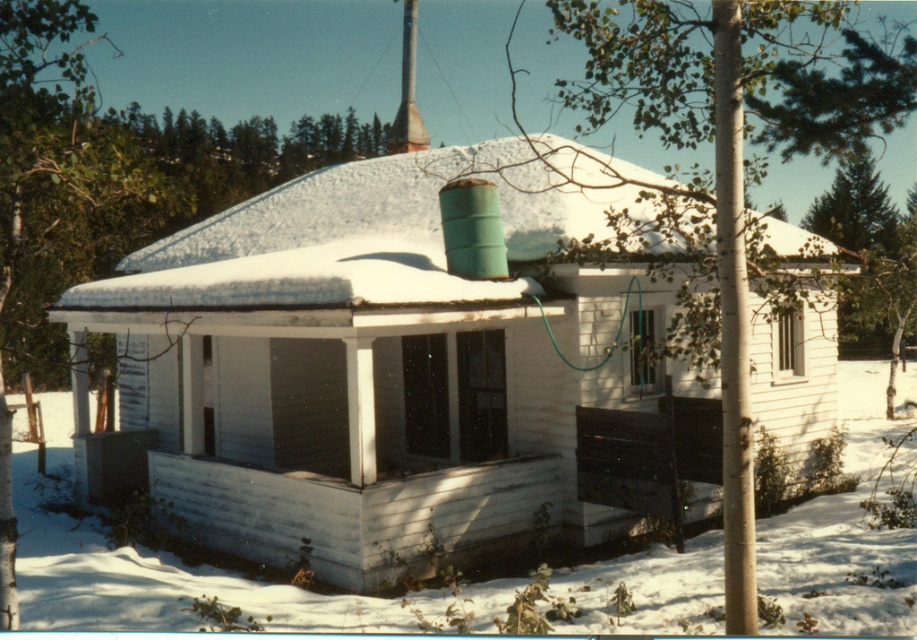
Question: Which of the following is the farthest from the observer?

Choices:
 (A) (0, 540)
 (B) (422, 262)
 (C) (809, 145)
 (D) (624, 349)

Answer: (D)

Question: Which of these objects is positioned farthest from the white painted wood cabin at center?

Choices:
 (A) green leafy tree at upper left
 (B) white shingles at upper center
 (C) green leafy tree at center

Answer: (C)

Question: Estimate the real-world distances between objects in this image. Which object is farther from the green leafy tree at upper left?

Choices:
 (A) green leafy tree at center
 (B) white shingles at upper center
 (C) white painted wood cabin at center

Answer: (A)

Question: Does green leafy tree at center appear over white shingles at upper center?

Choices:
 (A) no
 (B) yes

Answer: (B)

Question: Does white painted wood cabin at center have a larger size compared to white shingles at upper center?

Choices:
 (A) yes
 (B) no

Answer: (A)

Question: Considering the relative positions of white painted wood cabin at center and white shingles at upper center in the image provided, where is white painted wood cabin at center located with respect to white shingles at upper center?

Choices:
 (A) left
 (B) right

Answer: (A)